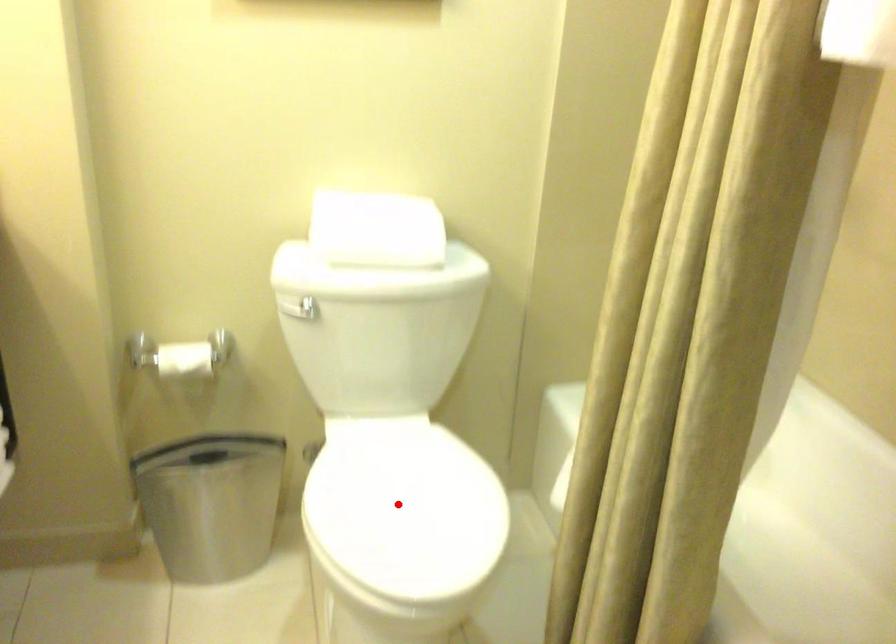
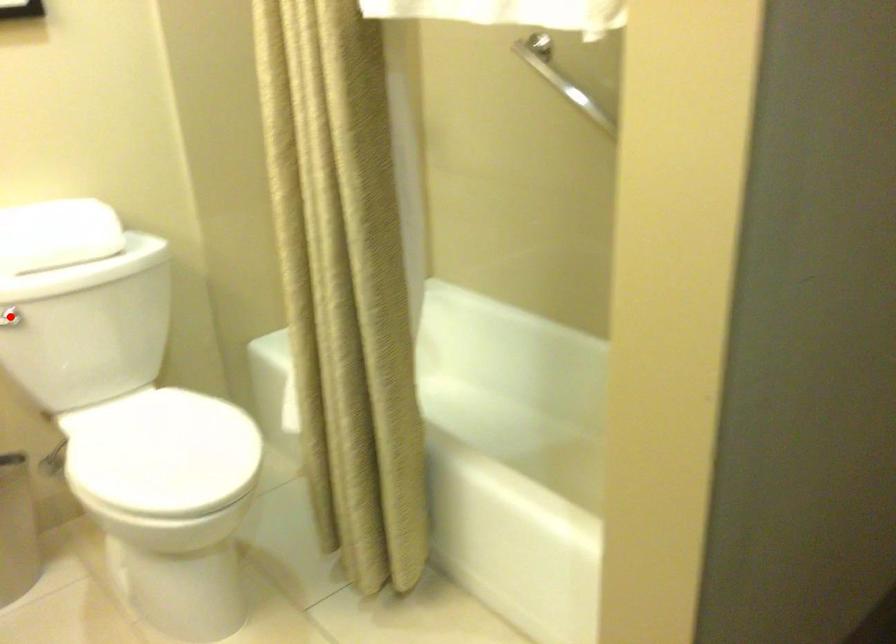
I am providing you with two images of the same scene from different viewpoints. A red point is marked on the first image and another point is marked on the second image. Are the points marked in image1 and image2 representing the same 3D position?

No